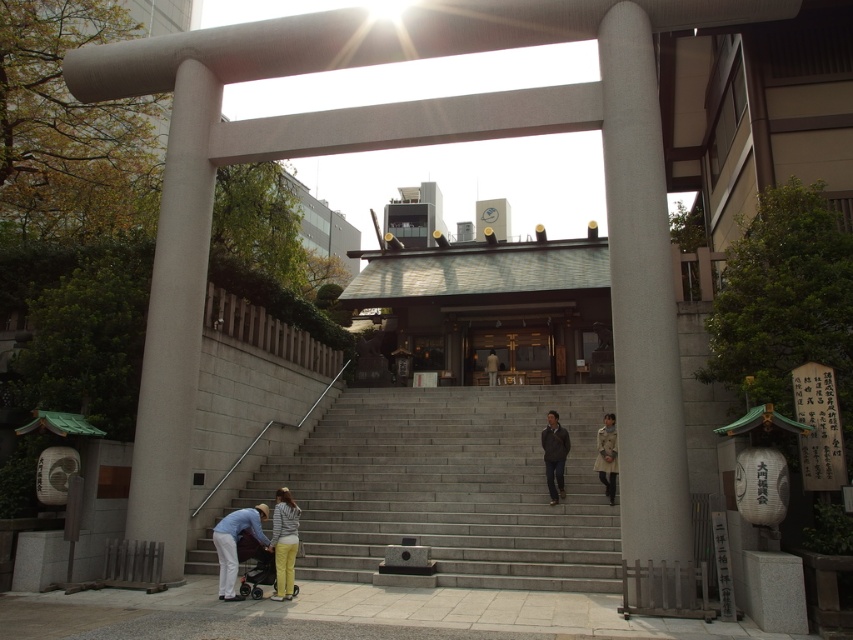
You are a visitor at the Shinto shrine and want to reach the wooden door at center. The gray concrete stairs at center is in your way. Can you walk around the stairs to reach the door?

The gray concrete stairs at center is 37.13 feet from the wooden door at center, so you can walk around the stairs to reach the wooden door at center as they are separate structures with distance between them.

You are visiting a Shinto shrine and need to enter the main building. You see the gray concrete stairs at center and the wooden door at center. Which one is wider?

The gray concrete stairs at center is wider than the wooden door at center.